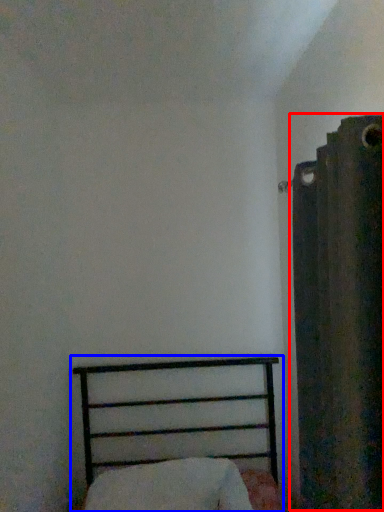
Question: Which object is further to the camera taking this photo, curtain (highlighted by a red box) or bed (highlighted by a blue box)?

Choices:
 (A) curtain
 (B) bed

Answer: (B)